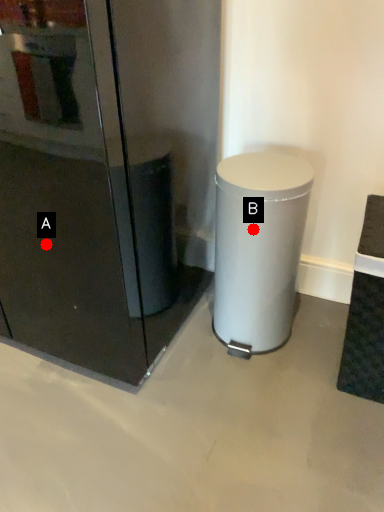
Question: Two points are circled on the image, labeled by A and B beside each circle. Which point is closer to the camera taking this photo?

Choices:
 (A) A is closer
 (B) B is closer

Answer: (A)